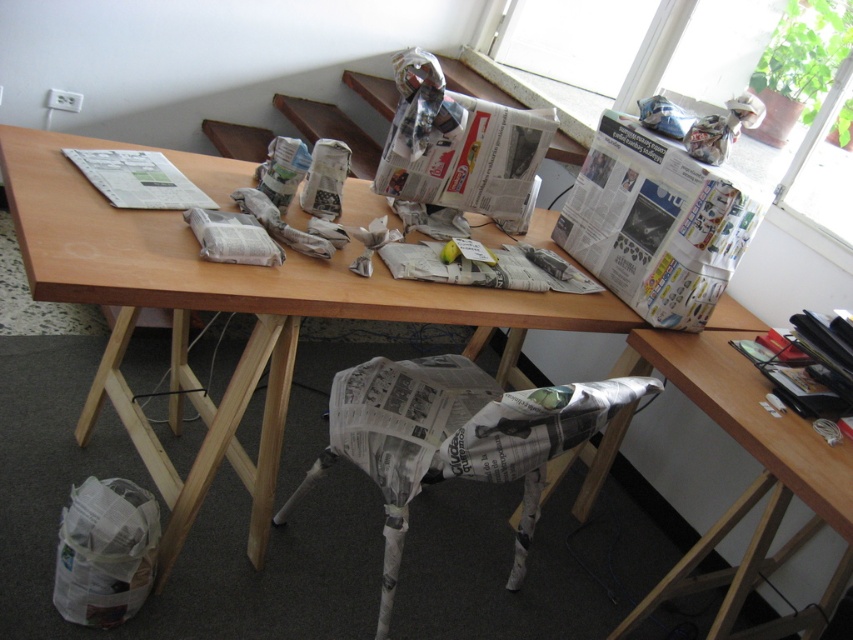
Question: Which object appears farthest from the camera in this image?

Choices:
 (A) wooden table at center
 (B) white newspaper at upper left
 (C) wooden table at lower right
 (D) newspaper-covered chair at lower center

Answer: (B)

Question: Is wooden table at center closer to camera compared to newspaper-covered chair at lower center?

Choices:
 (A) yes
 (B) no

Answer: (A)

Question: Does wooden table at center come in front of wooden table at lower right?

Choices:
 (A) no
 (B) yes

Answer: (B)

Question: Among these objects, which one is farthest from the camera?

Choices:
 (A) white newspaper at upper left
 (B) newspaper-covered chair at lower center
 (C) wooden table at lower right
 (D) wooden table at center

Answer: (A)

Question: Which object appears farthest from the camera in this image?

Choices:
 (A) white newspaper at upper left
 (B) wooden table at lower right
 (C) wooden table at center
 (D) newspaper-covered chair at lower center

Answer: (A)

Question: Is wooden table at lower right to the right of white newspaper at upper left from the viewer's perspective?

Choices:
 (A) yes
 (B) no

Answer: (A)